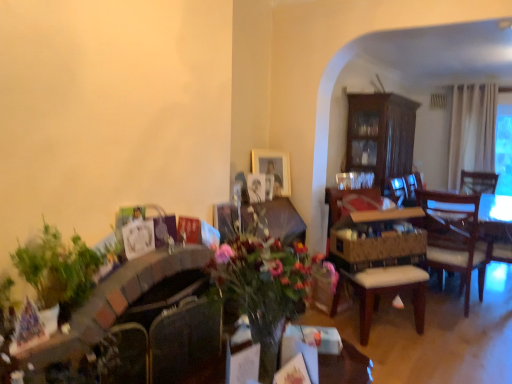
Question: Considering the relative sizes of wooden cushioned chair at center and wooden table at center in the image provided, is wooden cushioned chair at center smaller than wooden table at center?

Choices:
 (A) yes
 (B) no

Answer: (B)

Question: From the image's perspective, does wooden cushioned chair at center appear lower than wooden table at center?

Choices:
 (A) no
 (B) yes

Answer: (A)

Question: Does wooden cushioned chair at center contain wooden table at center?

Choices:
 (A) yes
 (B) no

Answer: (B)

Question: Is the depth of wooden cushioned chair at center less than that of wooden table at center?

Choices:
 (A) yes
 (B) no

Answer: (B)

Question: Can you confirm if wooden cushioned chair at center is taller than wooden table at center?

Choices:
 (A) no
 (B) yes

Answer: (B)

Question: Would you say dark wood cabinet at center-right is to the left or to the right of wooden armchair at center in the picture?

Choices:
 (A) right
 (B) left

Answer: (A)

Question: Considering the positions of dark wood cabinet at center-right and wooden armchair at center in the image, is dark wood cabinet at center-right wider or thinner than wooden armchair at center?

Choices:
 (A) wide
 (B) thin

Answer: (A)

Question: In the image, is dark wood cabinet at center-right positioned in front of or behind wooden armchair at center?

Choices:
 (A) front
 (B) behind

Answer: (B)

Question: Considering the positions of dark wood cabinet at center-right and wooden armchair at center in the image, is dark wood cabinet at center-right taller or shorter than wooden armchair at center?

Choices:
 (A) tall
 (B) short

Answer: (A)

Question: From the image's perspective, is dark wood cabinet at center-right above or below wooden cushioned chair at center?

Choices:
 (A) below
 (B) above

Answer: (B)

Question: Is dark wood cabinet at center-right in front of or behind wooden cushioned chair at center in the image?

Choices:
 (A) behind
 (B) front

Answer: (A)

Question: From a real-world perspective, is dark wood cabinet at center-right positioned above or below wooden cushioned chair at center?

Choices:
 (A) above
 (B) below

Answer: (A)

Question: Does point (365, 119) appear closer or farther from the camera than point (384, 221)?

Choices:
 (A) farther
 (B) closer

Answer: (A)

Question: From a real-world perspective, relative to wooden armchair at center, is wooden cushioned chair at center vertically above or below?

Choices:
 (A) above
 (B) below

Answer: (B)

Question: Would you say wooden cushioned chair at center is to the left or to the right of wooden armchair at center in the picture?

Choices:
 (A) left
 (B) right

Answer: (B)